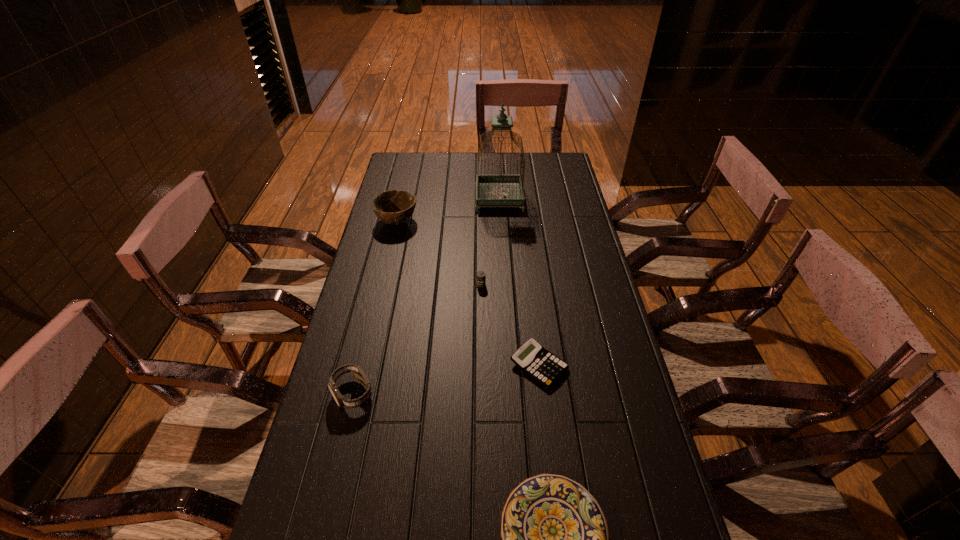
Find the location of a particular element. The width and height of the screenshot is (960, 540). vacant region located on the face of the watch is located at coordinates (342, 439).

Where is `free location located on the front of the fourth tallest object`? Image resolution: width=960 pixels, height=540 pixels. free location located on the front of the fourth tallest object is located at coordinates (481, 320).

Locate an element on the screen. vacant space located on the back of the fifth tallest object is located at coordinates (530, 287).

The width and height of the screenshot is (960, 540). Identify the location of bowl situated at the left edge. (393, 207).

Locate an element on the screen. watch at the left edge is located at coordinates (357, 372).

This screenshot has width=960, height=540. Find the location of `free spot at the far edge of the desktop`. free spot at the far edge of the desktop is located at coordinates (516, 156).

In the image, there is a desktop. At what (x,y) coordinates should I click in order to perform the action: click on vacant space at the right edge. Please return your answer as a coordinate pair (x, y). Looking at the image, I should click on (553, 217).

In the image, there is a desktop. Where is `vacant region at the far left corner`? This screenshot has height=540, width=960. vacant region at the far left corner is located at coordinates (427, 160).

Image resolution: width=960 pixels, height=540 pixels. What are the coordinates of `vacant space at the far right corner` in the screenshot? It's located at pos(555,156).

You are a GUI agent. You are given a task and a screenshot of the screen. Output one action in this format:
    pyautogui.click(x=<x>, y=<y>)
    Task: Click on the unoccupied area between the beer can and the watch
    
    Given the screenshot: What is the action you would take?
    pyautogui.click(x=417, y=339)